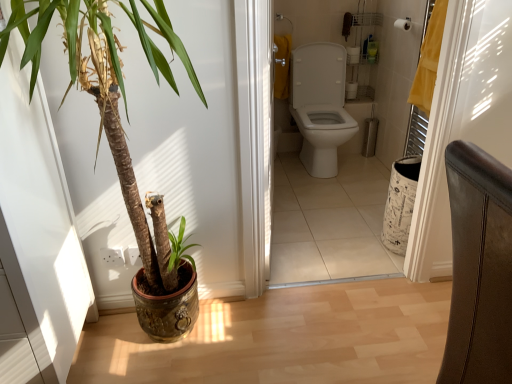
Question: Considering the relative positions of white matte toilet paper at upper center and leather-like chair at right in the image provided, is white matte toilet paper at upper center to the left of leather-like chair at right from the viewer's perspective?

Choices:
 (A) no
 (B) yes

Answer: (A)

Question: Can you confirm if white matte toilet paper at upper center is wider than leather-like chair at right?

Choices:
 (A) no
 (B) yes

Answer: (A)

Question: From a real-world perspective, is white matte toilet paper at upper center located beneath leather-like chair at right?

Choices:
 (A) no
 (B) yes

Answer: (A)

Question: Can you confirm if white matte toilet paper at upper center is bigger than leather-like chair at right?

Choices:
 (A) no
 (B) yes

Answer: (A)

Question: Is white matte toilet paper at upper center shorter than leather-like chair at right?

Choices:
 (A) yes
 (B) no

Answer: (A)

Question: Is white matte toilet paper at upper center closer to camera compared to leather-like chair at right?

Choices:
 (A) no
 (B) yes

Answer: (A)

Question: From the image's perspective, is white glossy toilet at center above leather-like chair at right?

Choices:
 (A) no
 (B) yes

Answer: (B)

Question: Would you consider white glossy toilet at center to be distant from leather-like chair at right?

Choices:
 (A) yes
 (B) no

Answer: (A)

Question: Is white glossy toilet at center located outside leather-like chair at right?

Choices:
 (A) no
 (B) yes

Answer: (B)

Question: Considering the relative sizes of white glossy toilet at center and leather-like chair at right in the image provided, is white glossy toilet at center thinner than leather-like chair at right?

Choices:
 (A) no
 (B) yes

Answer: (B)

Question: From a real-world perspective, is white glossy toilet at center located higher than leather-like chair at right?

Choices:
 (A) yes
 (B) no

Answer: (B)

Question: Is white glossy toilet at center to the right of leather-like chair at right from the viewer's perspective?

Choices:
 (A) no
 (B) yes

Answer: (A)

Question: Can you confirm if white glossy toilet at center is taller than green glossy plant at left?

Choices:
 (A) yes
 (B) no

Answer: (B)